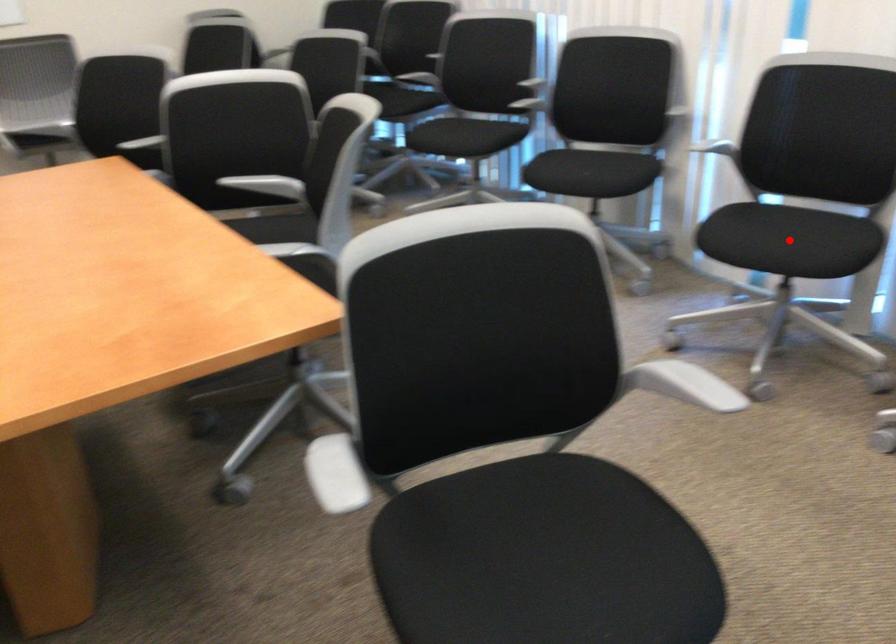
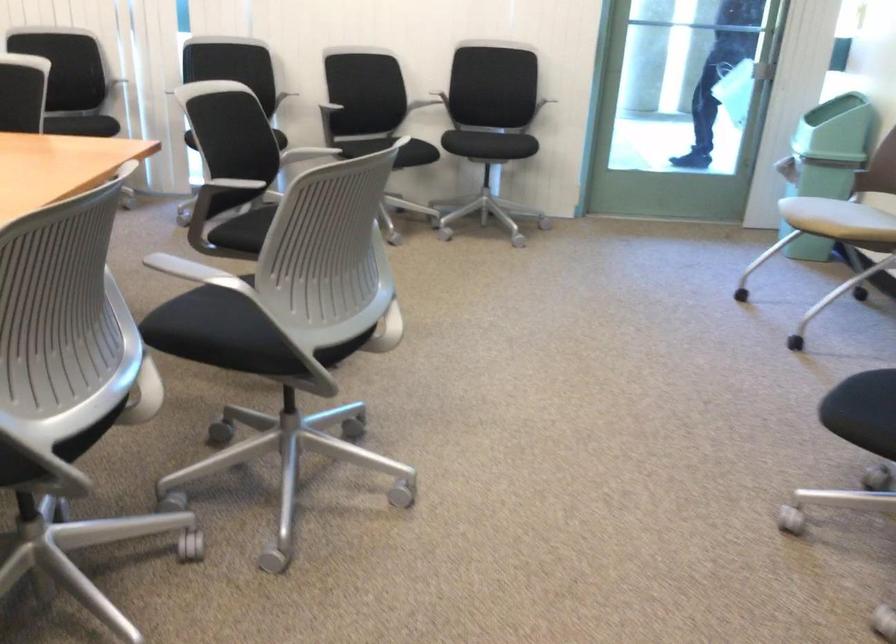
Question: I am providing you with two images of the same scene from different viewpoints. A red point is marked on the first image. At the location where the point appears in image 1, is it still visible in image 2?

Choices:
 (A) Yes
 (B) No

Answer: (B)